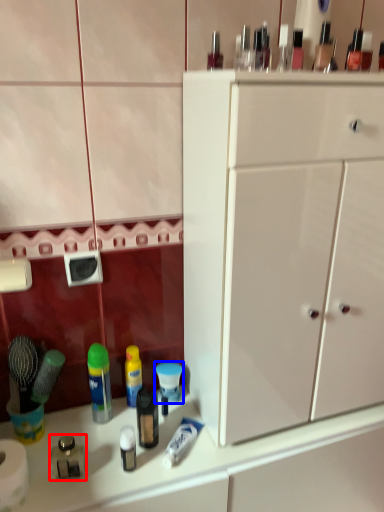
Question: Which point is further to the camera, toiletry (highlighted by a red box) or toiletry (highlighted by a blue box)?

Choices:
 (A) toiletry
 (B) toiletry

Answer: (B)